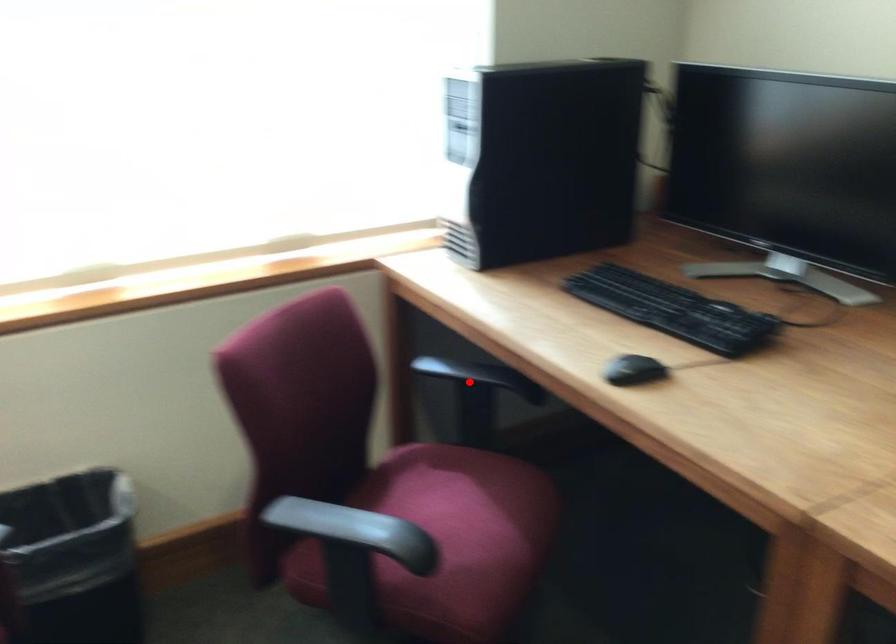
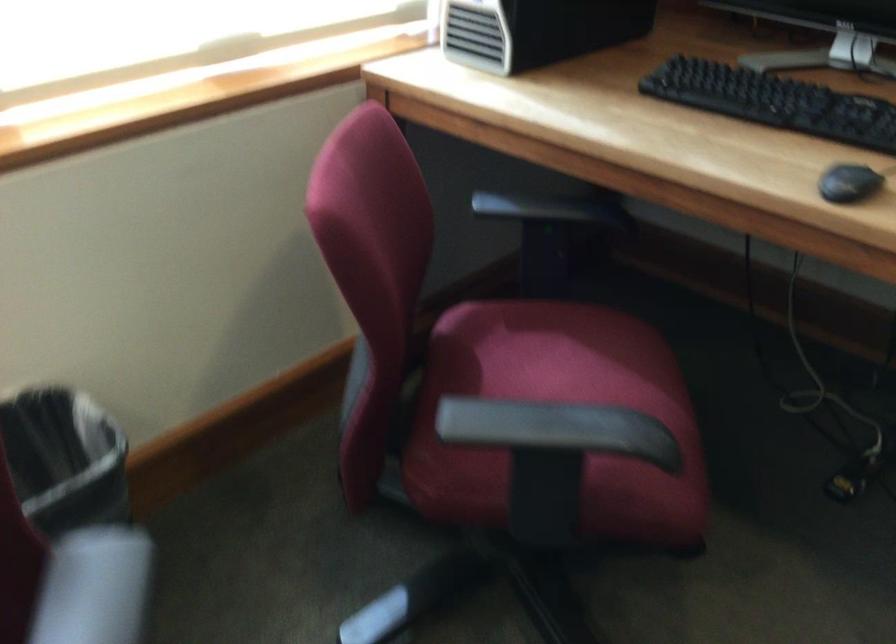
The point at the highlighted location is marked in the first image. Where is the corresponding point in the second image?

(555, 216)